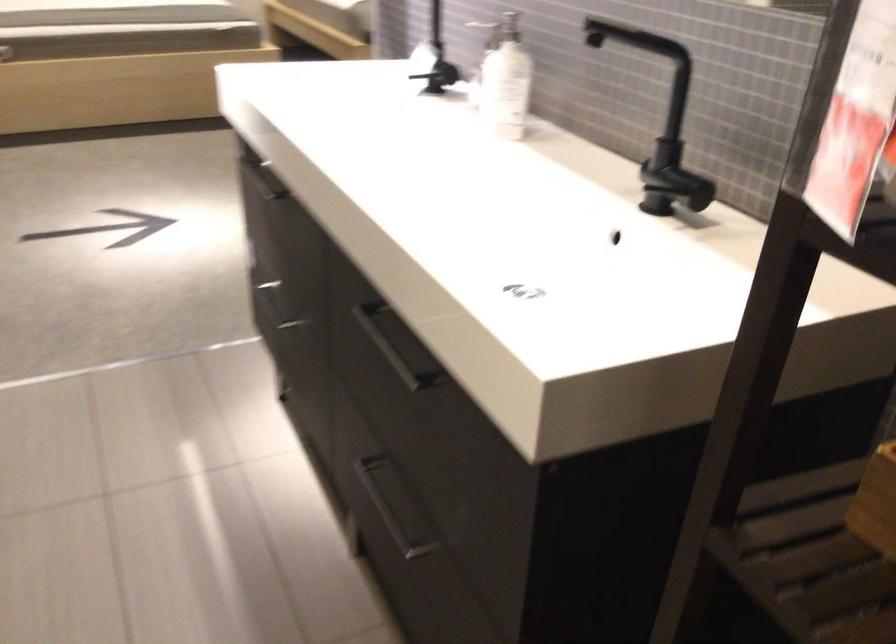
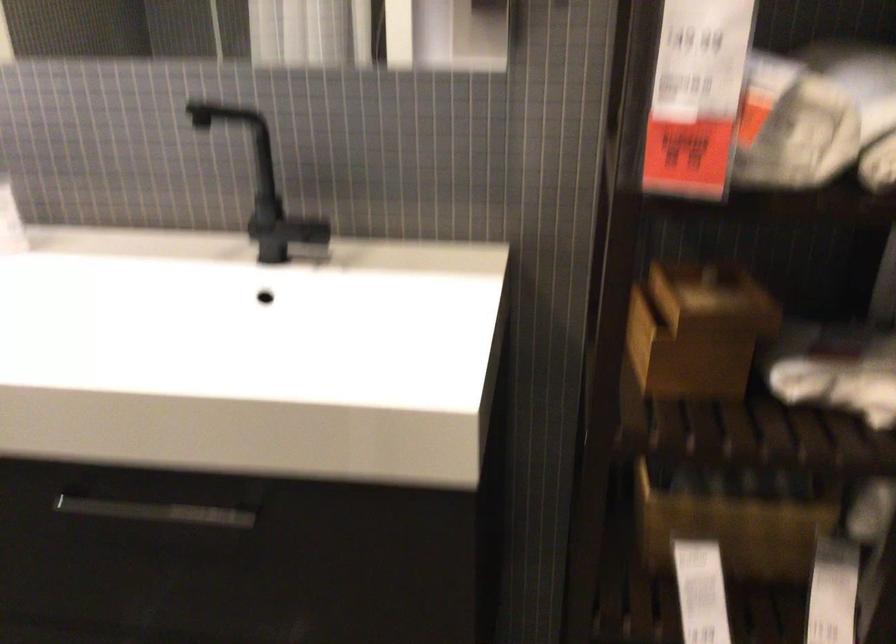
In the second image, find the point that corresponds to point 648,169 in the first image.

(268, 227)